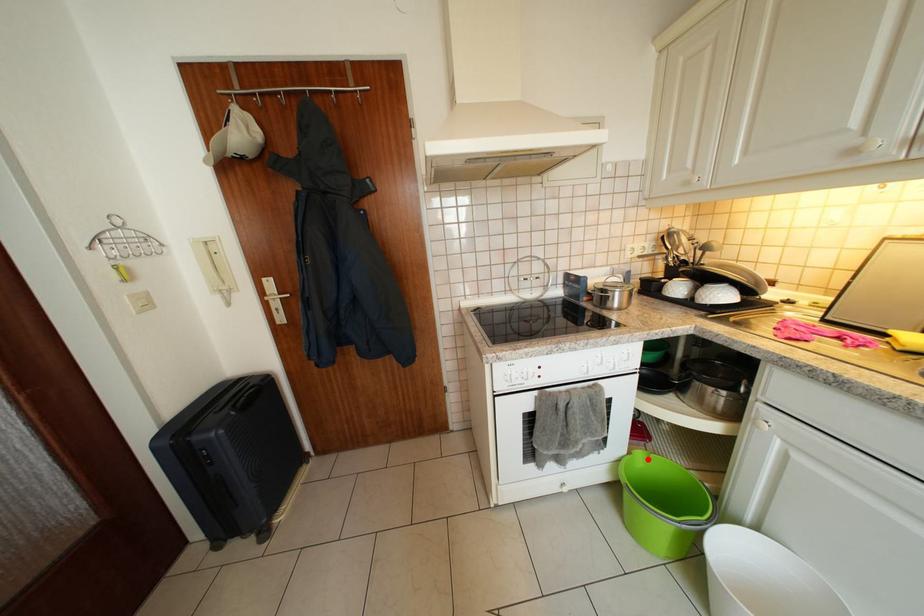
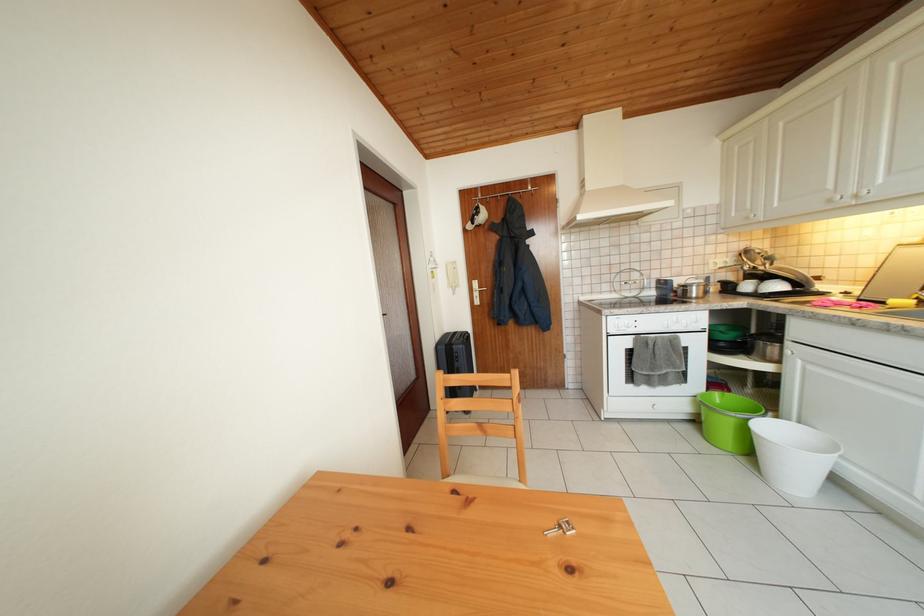
Where in the second image is the point corresponding to the highlighted location from the first image?

(724, 399)